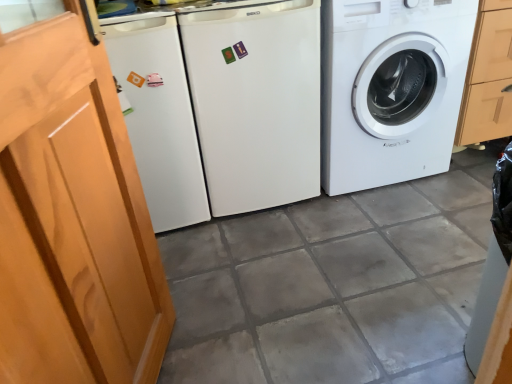
Question: From the image's perspective, does white glossy washing machine at right, placed as the 2th washing machine when sorted from left to right, appear lower than wooden screen door at left?

Choices:
 (A) no
 (B) yes

Answer: (A)

Question: From the image's perspective, is white glossy washing machine at right, the first washing machine viewed from the right, on top of wooden screen door at left?

Choices:
 (A) yes
 (B) no

Answer: (A)

Question: Can you confirm if white glossy washing machine at right, the first washing machine viewed from the right, is taller than wooden screen door at left?

Choices:
 (A) no
 (B) yes

Answer: (A)

Question: Is white glossy washing machine at right, the first washing machine viewed from the right, positioned beyond the bounds of wooden screen door at left?

Choices:
 (A) no
 (B) yes

Answer: (B)

Question: Is white glossy washing machine at right, the first washing machine viewed from the right, smaller than wooden screen door at left?

Choices:
 (A) no
 (B) yes

Answer: (A)

Question: Considering the relative positions of wooden screen door at left and white matte refrigerator at center, the second washing machine positioned from the right, in the image provided, is wooden screen door at left to the left or to the right of white matte refrigerator at center, the second washing machine positioned from the right,?

Choices:
 (A) right
 (B) left

Answer: (B)

Question: Considering their positions, is wooden screen door at left located in front of or behind white matte refrigerator at center, the second washing machine positioned from the right?

Choices:
 (A) behind
 (B) front

Answer: (B)

Question: Considering the positions of wooden screen door at left and white matte refrigerator at center, the second washing machine positioned from the right, in the image, is wooden screen door at left taller or shorter than white matte refrigerator at center, the second washing machine positioned from the right,?

Choices:
 (A) short
 (B) tall

Answer: (B)

Question: Considering the positions of point (74, 107) and point (201, 82), is point (74, 107) closer or farther from the camera than point (201, 82)?

Choices:
 (A) closer
 (B) farther

Answer: (A)

Question: From the image's perspective, is white matte refrigerator at center, the first washing machine viewed from the left, above or below white glossy washing machine at right, placed as the 2th washing machine when sorted from left to right?

Choices:
 (A) above
 (B) below

Answer: (B)

Question: From a real-world perspective, is white matte refrigerator at center, the first washing machine viewed from the left, positioned above or below white glossy washing machine at right, the first washing machine viewed from the right?

Choices:
 (A) above
 (B) below

Answer: (A)

Question: Considering the positions of white matte refrigerator at center, the second washing machine positioned from the right, and white glossy washing machine at right, placed as the 2th washing machine when sorted from left to right, in the image, is white matte refrigerator at center, the second washing machine positioned from the right, bigger or smaller than white glossy washing machine at right, placed as the 2th washing machine when sorted from left to right,?

Choices:
 (A) big
 (B) small

Answer: (B)

Question: Is white matte refrigerator at center, the second washing machine positioned from the right, in front of or behind white glossy washing machine at right, placed as the 2th washing machine when sorted from left to right, in the image?

Choices:
 (A) front
 (B) behind

Answer: (A)

Question: From their relative heights in the image, would you say white glossy washing machine at right, the first washing machine viewed from the right, is taller or shorter than wooden screen door at left?

Choices:
 (A) tall
 (B) short

Answer: (B)

Question: From the image's perspective, is white glossy washing machine at right, the first washing machine viewed from the right, positioned above or below wooden screen door at left?

Choices:
 (A) below
 (B) above

Answer: (B)